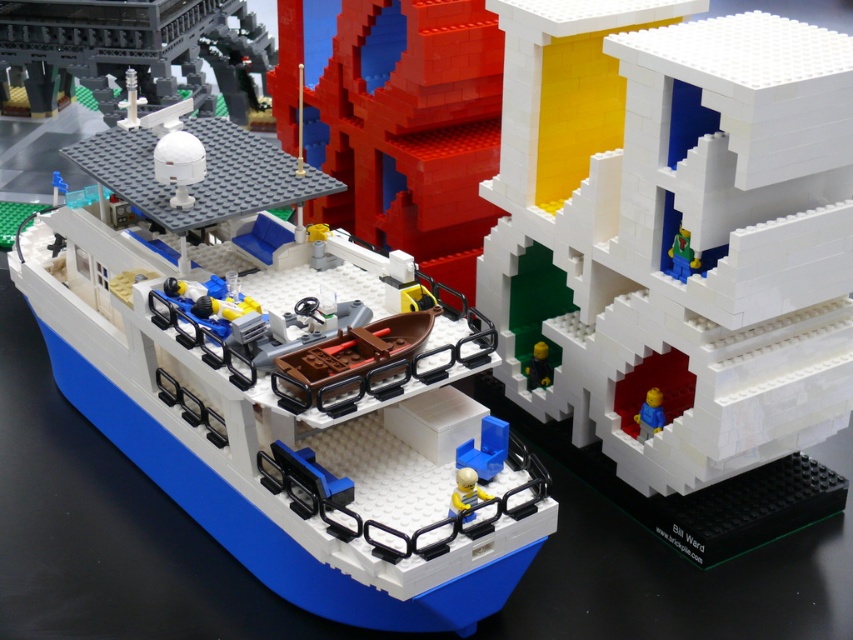
Does white matte building at center-right appear on the left side of blue matte boat at center?

Incorrect, white matte building at center-right is not on the left side of blue matte boat at center.

The height and width of the screenshot is (640, 853). Describe the element at coordinates (669, 260) in the screenshot. I see `white matte building at center-right` at that location.

Who is more forward, (x=762, y=147) or (x=410, y=442)?

Point (x=762, y=147) is in front.

Find the location of a particular element. This screenshot has width=853, height=640. white matte building at center-right is located at coordinates (669, 260).

Does smooth white sphere at upper left appear over blue plastic minifigure at center-right?

Correct, smooth white sphere at upper left is located above blue plastic minifigure at center-right.

Describe the element at coordinates (131, 48) in the screenshot. The height and width of the screenshot is (640, 853). I see `smooth white sphere at upper left` at that location.

The image size is (853, 640). What do you see at coordinates (131, 48) in the screenshot? I see `smooth white sphere at upper left` at bounding box center [131, 48].

You are a GUI agent. You are given a task and a screenshot of the screen. Output one action in this format:
    pyautogui.click(x=<x>, y=<y>)
    Task: Click on the smooth white sphere at upper left
    
    Given the screenshot: What is the action you would take?
    pyautogui.click(x=131, y=48)

Does blue matte boat at center appear on the left side of smooth white sphere at upper left?

Incorrect, blue matte boat at center is not on the left side of smooth white sphere at upper left.

Who is more distant from viewer, (213, 317) or (189, 83)?

Positioned behind is point (189, 83).

Find the location of a particular element. The height and width of the screenshot is (640, 853). blue matte boat at center is located at coordinates (276, 396).